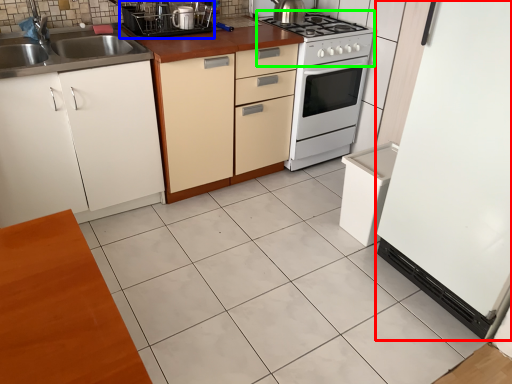
Question: Considering the real-world distances, which object is closest to appliance (highlighted by a red box)? appliance (highlighted by a blue box) or gas stove (highlighted by a green box).

Choices:
 (A) appliance
 (B) gas stove

Answer: (B)